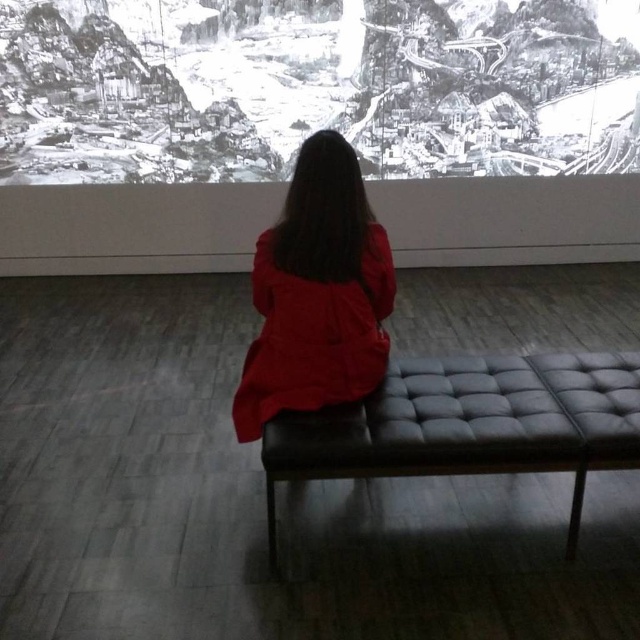
Question: Does leather-like black bench at center appear under red matte coat at center?

Choices:
 (A) no
 (B) yes

Answer: (B)

Question: Is leather-like black bench at center wider than red matte coat at center?

Choices:
 (A) no
 (B) yes

Answer: (B)

Question: Does leather-like black bench at center appear under red matte coat at center?

Choices:
 (A) no
 (B) yes

Answer: (B)

Question: Among these objects, which one is nearest to the camera?

Choices:
 (A) red matte coat at center
 (B) leather-like black bench at center

Answer: (B)

Question: Which of the following is the farthest from the observer?

Choices:
 (A) red matte coat at center
 (B) leather-like black bench at center

Answer: (A)